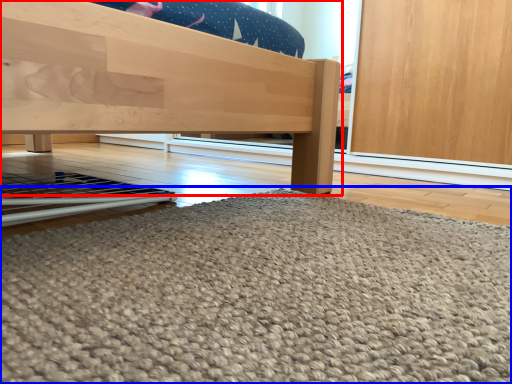
Question: Which point is closer to the camera, furniture (highlighted by a red box) or door (highlighted by a blue box)?

Choices:
 (A) furniture
 (B) door

Answer: (B)